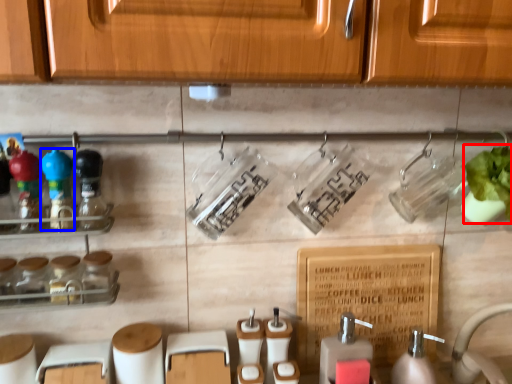
Question: Which object is further to the camera taking this photo, plant (highlighted by a red box) or bottle (highlighted by a blue box)?

Choices:
 (A) plant
 (B) bottle

Answer: (A)